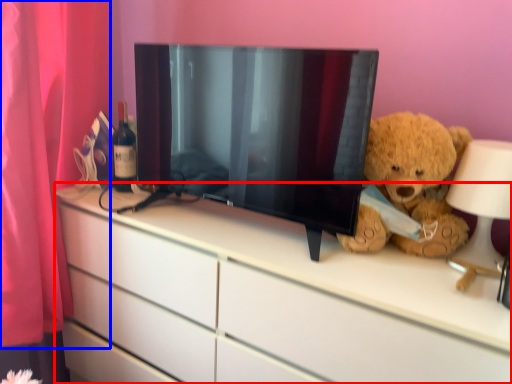
Question: Which of the following is the farthest to the observer, chest of drawers (highlighted by a red box) or curtain (highlighted by a blue box)?

Choices:
 (A) chest of drawers
 (B) curtain

Answer: (B)